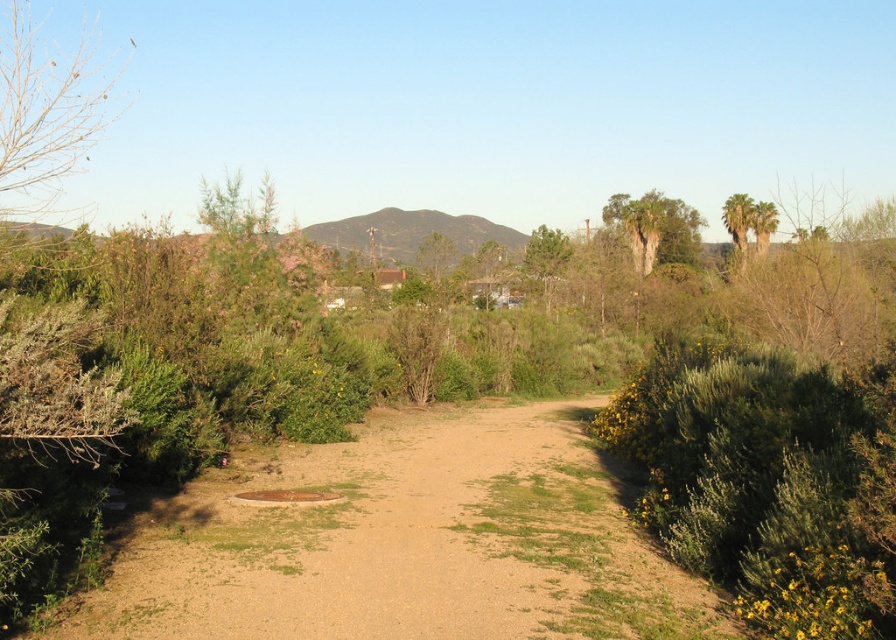
Question: Does green leafy bush at right have a greater width compared to bare branches at upper left?

Choices:
 (A) no
 (B) yes

Answer: (A)

Question: Which object appears farthest from the camera in this image?

Choices:
 (A) brown gravel path at center
 (B) green textured palm tree at upper right
 (C) bare branches at upper left

Answer: (B)

Question: Observing the image, what is the correct spatial positioning of green leafy bush at right in reference to bare branches at upper left?

Choices:
 (A) above
 (B) below

Answer: (B)

Question: Does green leafy bush at right appear on the left side of bare branches at upper left?

Choices:
 (A) yes
 (B) no

Answer: (B)

Question: Which is farther from the bare branches at upper left?

Choices:
 (A) brown gravel path at center
 (B) green textured palm tree at upper right
 (C) green leafy bush at right

Answer: (B)

Question: Which point is closer to the camera?

Choices:
 (A) green textured palm tree at upper right
 (B) bare branches at upper left
 (C) brown gravel path at center

Answer: (C)